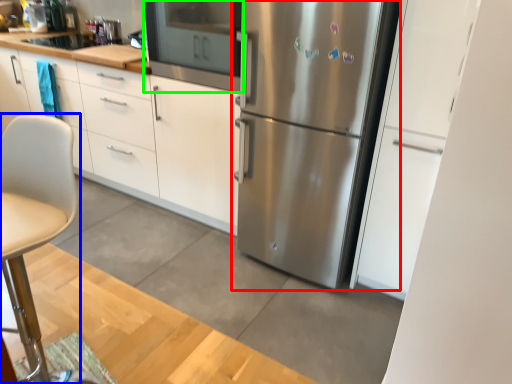
Question: Based on their relative distances, which object is farther from refrigerator (highlighted by a red box)? Choose from chair (highlighted by a blue box) and oven (highlighted by a green box).

Choices:
 (A) chair
 (B) oven

Answer: (A)